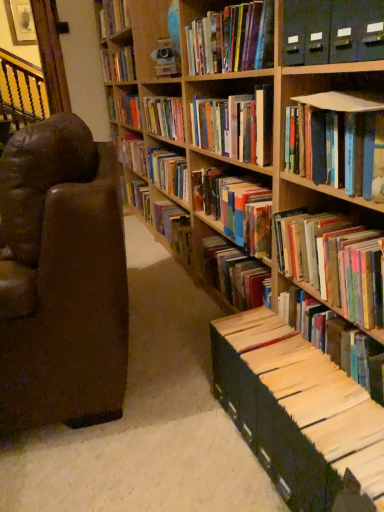
Question: Could you tell me if hardcover books at center, arranged as the tenth book when viewed from the top, is facing brown leather chair at left?

Choices:
 (A) yes
 (B) no

Answer: (B)

Question: Does hardcover books at center, marked as the 2th book in a bottom-to-top arrangement, lie behind brown leather chair at left?

Choices:
 (A) yes
 (B) no

Answer: (B)

Question: Is hardcover books at center, marked as the 2th book in a bottom-to-top arrangement, positioned far away from brown leather chair at left?

Choices:
 (A) no
 (B) yes

Answer: (A)

Question: From a real-world perspective, is hardcover books at center, arranged as the tenth book when viewed from the top, located higher than brown leather chair at left?

Choices:
 (A) no
 (B) yes

Answer: (B)

Question: Is hardcover books at center, arranged as the tenth book when viewed from the top, with brown leather chair at left?

Choices:
 (A) yes
 (B) no

Answer: (B)

Question: From the image's perspective, is hardcover books at center, arranged as the tenth book when viewed from the top, located above brown leather chair at left?

Choices:
 (A) no
 (B) yes

Answer: (A)

Question: Is white paper at lower right, which is counted as the eleventh book, starting from the top, facing towards hardcover book at center, which ranks as the eighth book in top-to-bottom order?

Choices:
 (A) no
 (B) yes

Answer: (A)

Question: Is white paper at lower right, which is counted as the eleventh book, starting from the top, shorter than hardcover book at center, placed as the 4th book when sorted from bottom to top?

Choices:
 (A) yes
 (B) no

Answer: (B)

Question: From the image's perspective, does white paper at lower right, which is counted as the first book, starting from the bottom, appear lower than hardcover book at center, which ranks as the eighth book in top-to-bottom order?

Choices:
 (A) no
 (B) yes

Answer: (B)

Question: Is white paper at lower right, which is counted as the eleventh book, starting from the top, touching hardcover book at center, which ranks as the eighth book in top-to-bottom order?

Choices:
 (A) no
 (B) yes

Answer: (A)

Question: Can you confirm if white paper at lower right, which is counted as the first book, starting from the bottom, is smaller than hardcover book at center, placed as the 4th book when sorted from bottom to top?

Choices:
 (A) no
 (B) yes

Answer: (B)

Question: Is white paper at lower right, which is counted as the eleventh book, starting from the top, oriented away from hardcover book at center, which ranks as the eighth book in top-to-bottom order?

Choices:
 (A) yes
 (B) no

Answer: (B)

Question: Is hardcover book at upper center, acting as the ninth book starting from the bottom, located within brown leather chair at left?

Choices:
 (A) no
 (B) yes

Answer: (A)